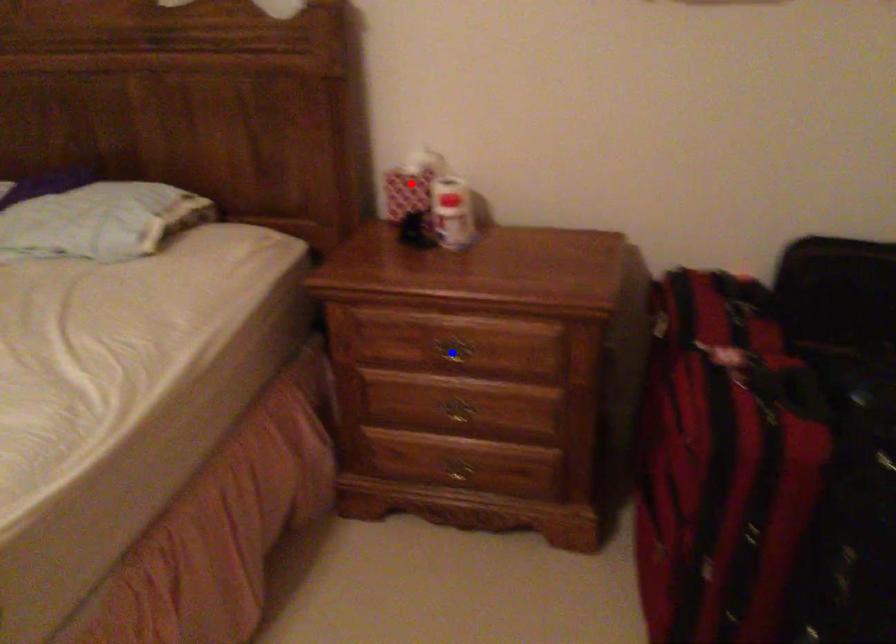
Question: In the image, two points are highlighted. Which point is nearer to the camera? Reply with the corresponding letter.

Choices:
 (A) blue point
 (B) red point

Answer: (A)